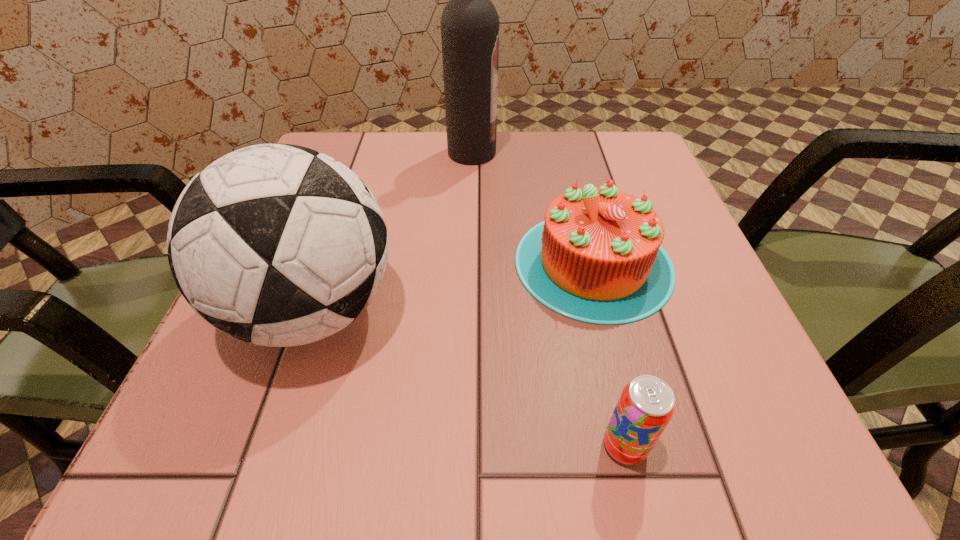
Locate an element on the screen. the tallest object is located at coordinates (469, 22).

Find the location of a particular element. The height and width of the screenshot is (540, 960). the third object from right to left is located at coordinates (469, 22).

Image resolution: width=960 pixels, height=540 pixels. Identify the location of soccer ball. (276, 244).

The height and width of the screenshot is (540, 960). What are the coordinates of `the second tallest object` in the screenshot? It's located at (276, 244).

The width and height of the screenshot is (960, 540). What are the coordinates of `cake` in the screenshot? It's located at (597, 257).

Find the location of a particular element. This screenshot has height=540, width=960. the shortest object is located at coordinates (646, 405).

Locate an element on the screen. soda can is located at coordinates (646, 405).

Locate an element on the screen. Image resolution: width=960 pixels, height=540 pixels. free spot located on the label of the second object from left to right is located at coordinates (573, 153).

Locate an element on the screen. The width and height of the screenshot is (960, 540). blank area located 0.090m on the surface of the soccer ball where the brand logo is visible is located at coordinates (460, 310).

The image size is (960, 540). I want to click on vacant area situated on the left of the cake, so click(460, 263).